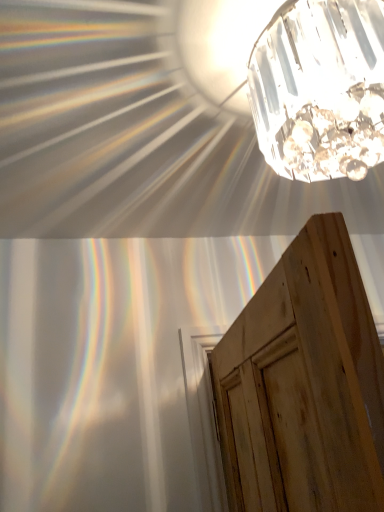
You are a GUI agent. You are given a task and a screenshot of the screen. Output one action in this format:
    pyautogui.click(x=<x>, y=<y>)
    Task: Click on the clear crystal chandelier at upper right
    The height and width of the screenshot is (512, 384).
    Given the screenshot: What is the action you would take?
    pyautogui.click(x=320, y=89)

In order to face clear crystal chandelier at upper right, should I rotate leftwards or rightwards?

You should look right and rotate roughly 18.206 degrees.

What is the approximate width of clear crystal chandelier at upper right?

The width of clear crystal chandelier at upper right is 16.49 inches.

What do you see at coordinates (320, 89) in the screenshot? Image resolution: width=384 pixels, height=512 pixels. I see `clear crystal chandelier at upper right` at bounding box center [320, 89].

This screenshot has width=384, height=512. I want to click on clear crystal chandelier at upper right, so click(320, 89).